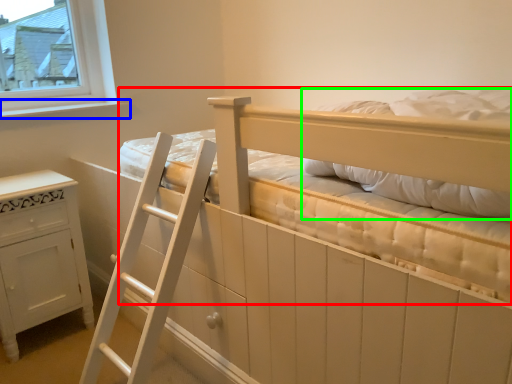
Question: Estimate the real-world distances between objects in this image. Which object is farther from bed (highlighted by a red box), window sill (highlighted by a blue box) or pillow (highlighted by a green box)?

Choices:
 (A) window sill
 (B) pillow

Answer: (A)